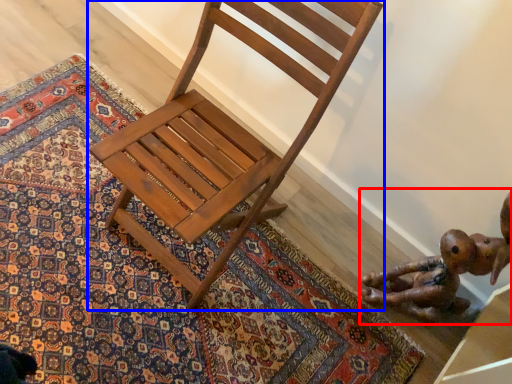
Question: Which of the following is the closest to the observer, toy (highlighted by a red box) or chair (highlighted by a blue box)?

Choices:
 (A) toy
 (B) chair

Answer: (B)